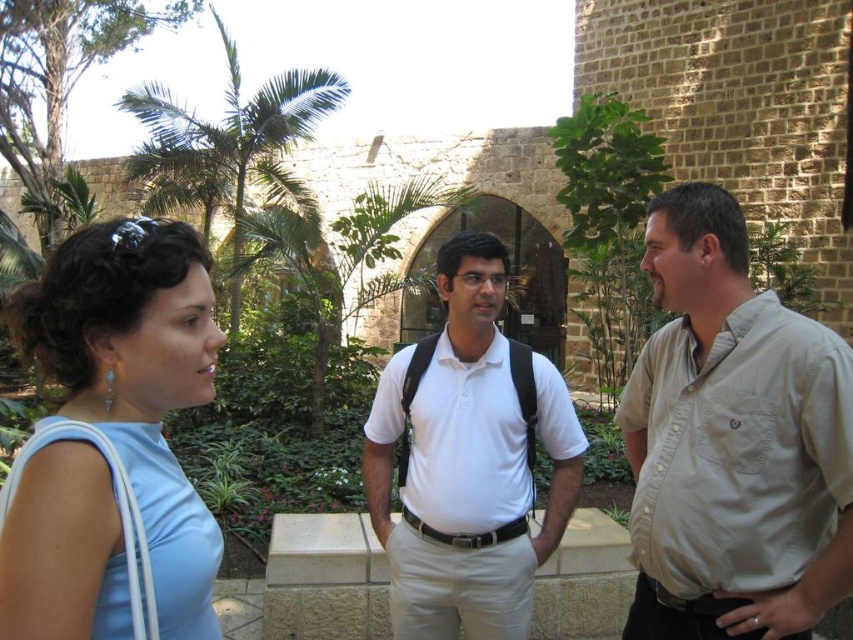
Question: Does khaki shirt at right appear under light blue fabric dress at left?

Choices:
 (A) yes
 (B) no

Answer: (A)

Question: Is khaki shirt at right below white matte shirt at center?

Choices:
 (A) no
 (B) yes

Answer: (B)

Question: Estimate the real-world distances between objects in this image. Which object is farther from the matte white shirt at center?

Choices:
 (A) light blue fabric dress at left
 (B) khaki shirt at right

Answer: (A)

Question: Which point is farther to the camera?

Choices:
 (A) white matte shirt at center
 (B) light blue fabric dress at left
 (C) khaki shirt at right
 (D) matte white shirt at center

Answer: (A)

Question: Among these objects, which one is nearest to the camera?

Choices:
 (A) white matte shirt at center
 (B) light blue fabric dress at left
 (C) khaki shirt at right

Answer: (B)

Question: Does khaki shirt at right appear under light blue fabric dress at left?

Choices:
 (A) no
 (B) yes

Answer: (B)